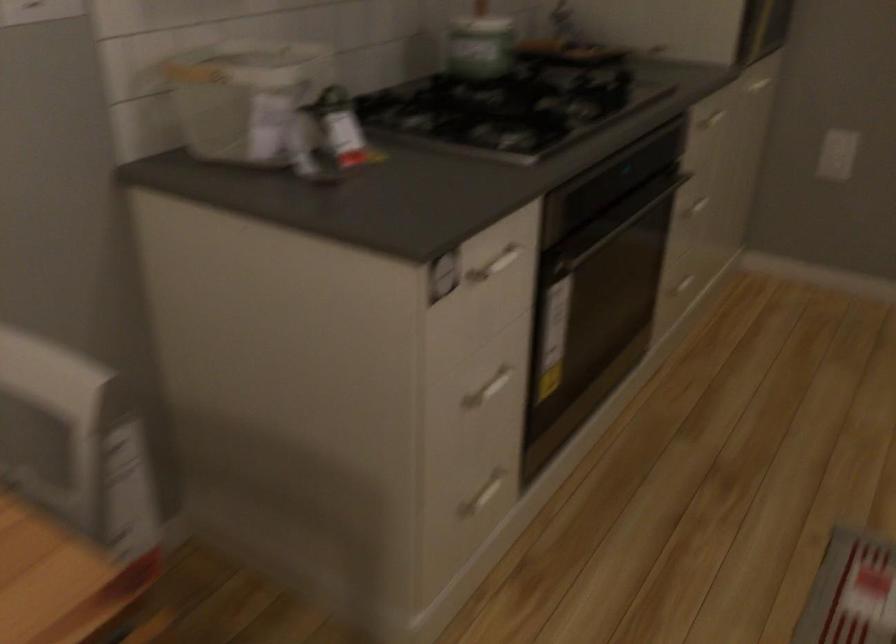
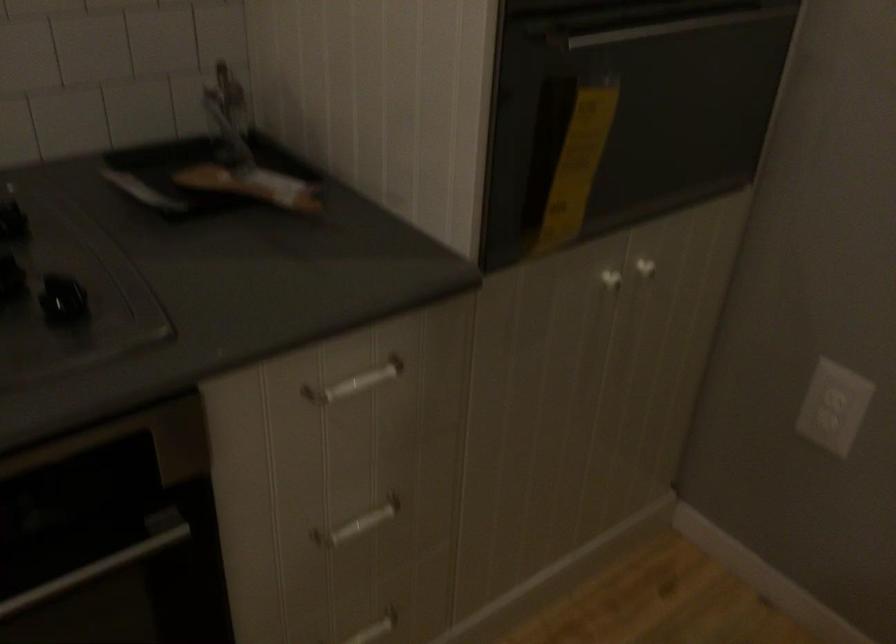
Find the pixel in the second image that matches point (673, 190) in the first image.

(97, 567)